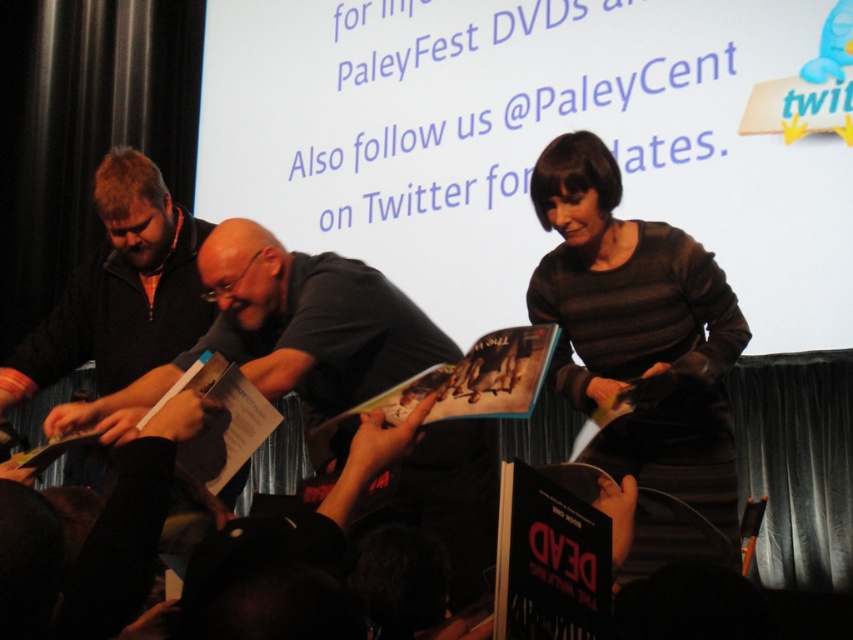
Question: Which is nearer to the hardcover book at center?

Choices:
 (A) white paper book at center
 (B) dark gray striped sweater at center
 (C) dark gray shirt at center
 (D) dark brown sweater at left

Answer: (C)

Question: Can you confirm if dark gray striped sweater at center is bigger than white paper book at center?

Choices:
 (A) no
 (B) yes

Answer: (A)

Question: In this image, where is hardcover book at center located relative to white paper book at center?

Choices:
 (A) left
 (B) right

Answer: (B)

Question: Does dark brown sweater at left have a smaller size compared to hardcover book at center?

Choices:
 (A) no
 (B) yes

Answer: (B)

Question: Which object appears closest to the camera in this image?

Choices:
 (A) dark brown sweater at left
 (B) dark gray shirt at center
 (C) white paper book at center
 (D) hardcover book at center

Answer: (D)

Question: Which object is the farthest from the hardcover book at center?

Choices:
 (A) dark gray striped sweater at center
 (B) dark brown sweater at left

Answer: (B)